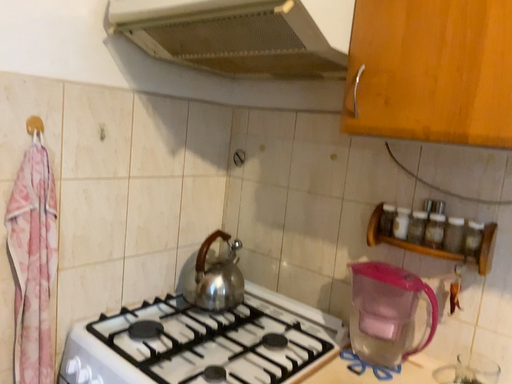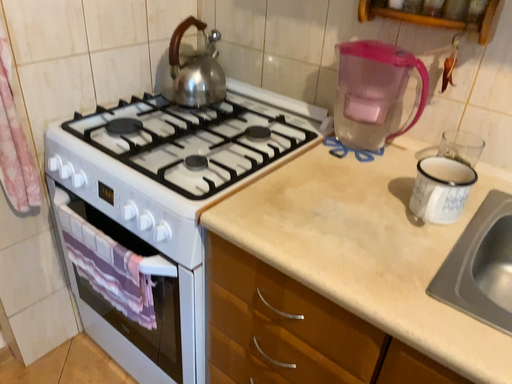
Question: Which way did the camera rotate in the video?

Choices:
 (A) rotated downward
 (B) rotated upward

Answer: (A)